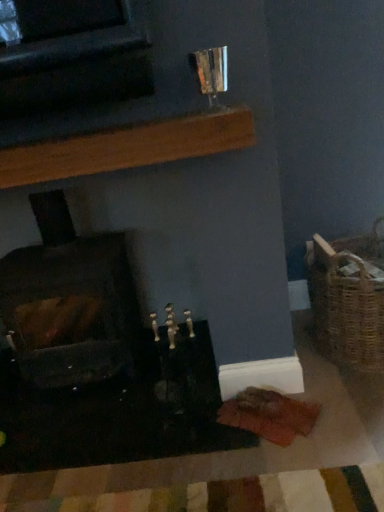
At what (x,y) coordinates should I click in order to perform the action: click on dark brown wood at left. Please return your answer as a coordinate pair (x, y). The image size is (384, 512). Looking at the image, I should click on (69, 302).

In the scene shown: Measure the distance between point (337, 266) and camera.

Point (337, 266) is 5.71 feet from camera.

The height and width of the screenshot is (512, 384). I want to click on wooden plank at upper center, so click(x=128, y=147).

Based on the photo, from a real-world perspective, is dark brown wood at left located beneath woven brown basket at right?

Actually, dark brown wood at left is physically above woven brown basket at right in the real world.

Find the location of a particular element. The width and height of the screenshot is (384, 512). basket that is on the right side of dark brown wood at left is located at coordinates (346, 306).

Considering the relative positions of wooden plank at upper center and dark brown wood at left in the image provided, is wooden plank at upper center behind dark brown wood at left?

No, wooden plank at upper center is closer to the camera.

Is wooden plank at upper center looking in the opposite direction of dark brown wood at left?

That's not correct — wooden plank at upper center is not looking away from dark brown wood at left.

Would you say wooden plank at upper center is a long distance from dark brown wood at left?

They are positioned close to each other.

Which is less distant, (345, 298) or (7, 184)?

Positioned in front is point (7, 184).

How different are the orientations of woven brown basket at right and wooden plank at upper center in degrees?

They differ by 0.228 degrees in their facing directions.

Which object is further away from the camera, woven brown basket at right or wooden plank at upper center?

Positioned behind is woven brown basket at right.

Does point (372, 327) come in front of point (24, 327)?

Yes, point (372, 327) is in front of point (24, 327).

Which is more to the right, woven brown basket at right or dark brown wood at left?

Positioned to the right is woven brown basket at right.

Between woven brown basket at right and dark brown wood at left, which one has less height?

With less height is woven brown basket at right.

Can you confirm if dark brown wood at left is shorter than wooden plank at upper center?

In fact, dark brown wood at left may be taller than wooden plank at upper center.

In the scene shown: Between dark brown wood at left and wooden plank at upper center, which one has larger width?

Wider between the two is dark brown wood at left.

Which is in front, point (189, 136) or point (326, 268)?

The point (189, 136) is in front.

Which of these two, wooden plank at upper center or woven brown basket at right, is wider?

With larger width is woven brown basket at right.

Looking at this image, who is smaller, wooden plank at upper center or woven brown basket at right?

wooden plank at upper center is smaller.

Measure the distance from wooden plank at upper center to woven brown basket at right.

wooden plank at upper center and woven brown basket at right are 36.54 inches apart from each other.

Identify the location of basket on the right side of dark brown wood at left. This screenshot has width=384, height=512. (346, 306).

You are a GUI agent. You are given a task and a screenshot of the screen. Output one action in this format:
    pyautogui.click(x=<x>, y=<y>)
    Task: Click on the wood burning stove behind the wooden plank at upper center
    
    Given the screenshot: What is the action you would take?
    (x=69, y=302)

Considering their positions, is woven brown basket at right positioned closer to wooden plank at upper center than dark brown wood at left?

dark brown wood at left.

Based on their spatial positions, is wooden plank at upper center or dark brown wood at left further from woven brown basket at right?

dark brown wood at left lies further to woven brown basket at right than the other object.

Looking at the image, which one is located closer to wooden plank at upper center, dark brown wood at left or woven brown basket at right?

dark brown wood at left.

Estimate the real-world distances between objects in this image. Which object is closer to woven brown basket at right, dark brown wood at left or wooden plank at upper center?

Based on the image, wooden plank at upper center appears to be nearer to woven brown basket at right.

Looking at the image, which one is located closer to dark brown wood at left, woven brown basket at right or wooden plank at upper center?

Among the two, wooden plank at upper center is located nearer to dark brown wood at left.

Based on their spatial positions, is wooden plank at upper center or woven brown basket at right closer to dark brown wood at left?

wooden plank at upper center lies closer to dark brown wood at left than the other object.

At what (x,y) coordinates should I click in order to perform the action: click on shelf located between dark brown wood at left and woven brown basket at right in the left-right direction. Please return your answer as a coordinate pair (x, y). Looking at the image, I should click on (128, 147).